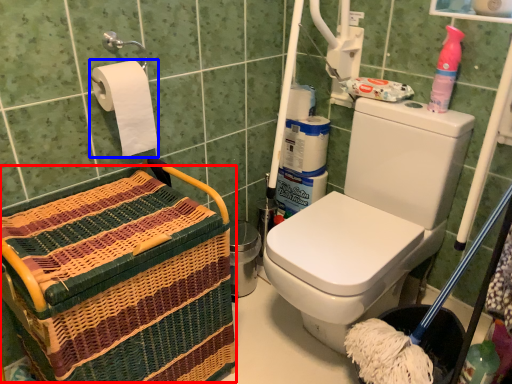
Question: Which of the following is the farthest to the observer, basket (highlighted by a red box) or toilet paper (highlighted by a blue box)?

Choices:
 (A) basket
 (B) toilet paper

Answer: (B)